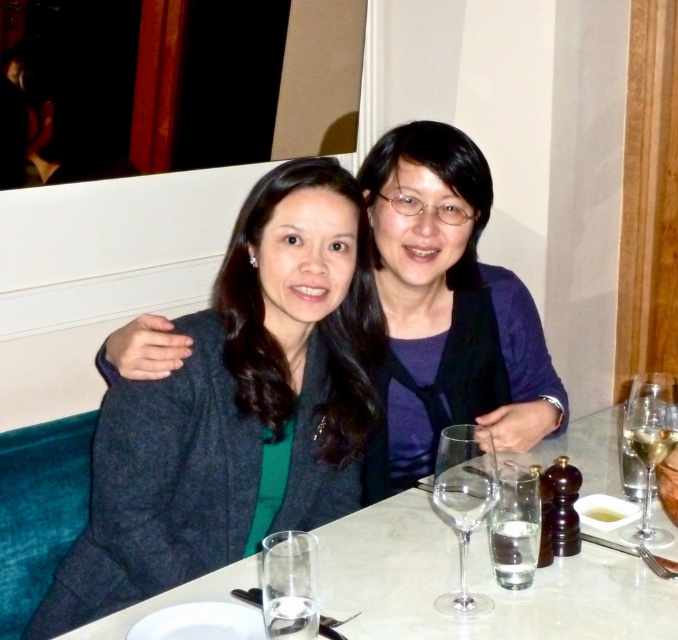
You are standing at the point labeled as point [523,362] in the image. You want to reach the door located at the opposite side of the room without moving any objects on the table. Can you walk directly to the door from your current position?

The point [523,362] and the viewer are 1.78 meters apart. Since there are no objects mentioned between the point and the door, you can walk directly to the door from point [523,362].

From the picture: You are a waiter at the restaurant and need to place a new drink order between the two points on the table labeled as point (471,333) and point (462,513). Which point should you choose to ensure the drink is closer to the customer sitting on the right?

You should place the drink closer to point (471,333) because it is closer to the customer on the right compared to point (462,513).

You are a waiter at the restaurant and need to place a new drink order for the clear glass wine glass at right. To ensure you don not accidentally place it behind the matte black blazer at center, where should you place the new drink?

You should place the new drink in front of the clear glass wine glass at right, as the matte black blazer at center is closer to you and placing it behind might not be visible or accessible.